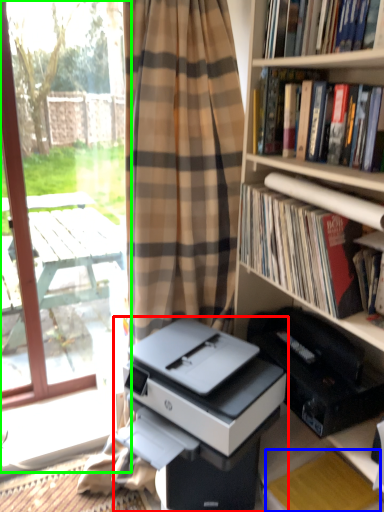
Question: Considering the real-world distances, which object is closest to printer (highlighted by a red box)? paperback book (highlighted by a blue box) or screen door (highlighted by a green box).

Choices:
 (A) paperback book
 (B) screen door

Answer: (A)